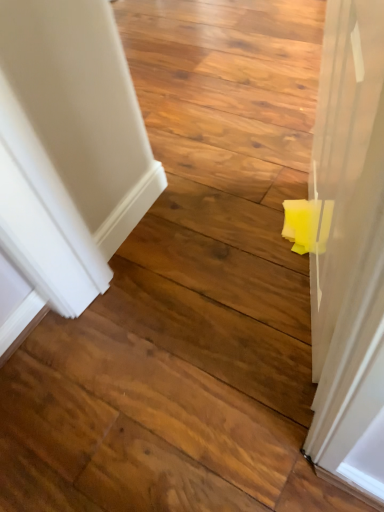
In order to click on blank area beneath yellow sponge at right (from a real-world perspective) in this screenshot , I will do `click(297, 298)`.